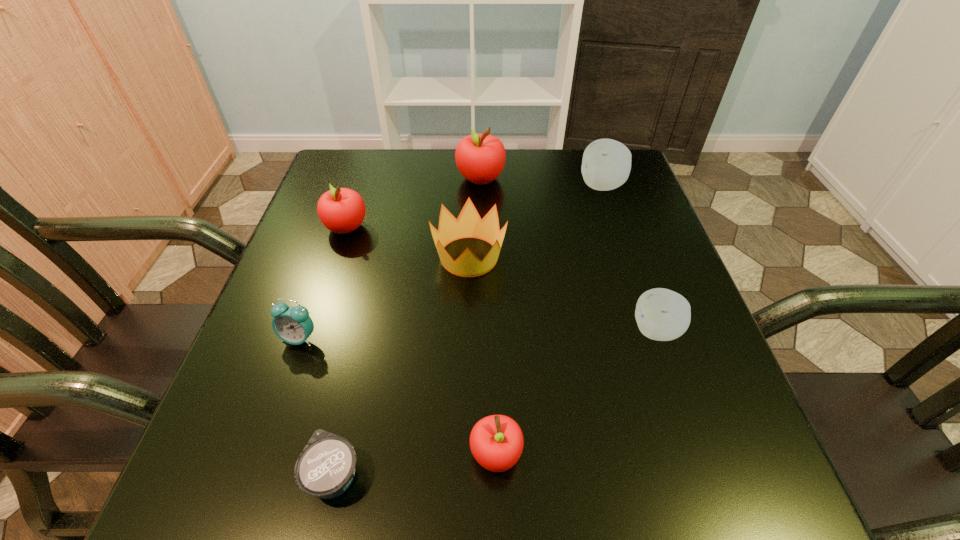
Locate an element on the screen. Image resolution: width=960 pixels, height=540 pixels. free space between the smaller white apple and the alarm clock is located at coordinates (478, 334).

This screenshot has height=540, width=960. Find the location of `object identified as the seventh closest to the shortest object`. object identified as the seventh closest to the shortest object is located at coordinates pos(606,164).

Locate an element on the screen. the fourth closest object relative to the biggest red apple is located at coordinates (661, 314).

Identify the location of apple that is the third closest one to the alarm clock. (480, 158).

You are a GUI agent. You are given a task and a screenshot of the screen. Output one action in this format:
    pyautogui.click(x=<x>, y=<y>)
    Task: Click on the closest apple to the alarm clock
    The height and width of the screenshot is (540, 960).
    Given the screenshot: What is the action you would take?
    pyautogui.click(x=341, y=210)

Select which red apple appears as the third closest to the nearer white apple. Please provide its 2D coordinates. Your answer should be formatted as a tuple, i.e. [(x, y)], where the tuple contains the x and y coordinates of a point satisfying the conditions above.

[(341, 210)]

Choose which red apple is the second nearest neighbor to the smallest red apple. Please provide its 2D coordinates. Your answer should be formatted as a tuple, i.e. [(x, y)], where the tuple contains the x and y coordinates of a point satisfying the conditions above.

[(480, 158)]

Image resolution: width=960 pixels, height=540 pixels. What are the coordinates of `free spot that satisfies the following two spatial constraints: 1. on the back side of the bigger white apple; 2. on the left side of the third object from left to right` in the screenshot? It's located at point(398,186).

Where is `free space that satisfies the following two spatial constraints: 1. on the back side of the leftmost red apple; 2. on the right side of the biggest red apple`? free space that satisfies the following two spatial constraints: 1. on the back side of the leftmost red apple; 2. on the right side of the biggest red apple is located at coordinates (362, 179).

What are the coordinates of `vacant region that satisfies the following two spatial constraints: 1. on the face of the nearest red apple; 2. on the left side of the alarm clock` in the screenshot? It's located at (259, 454).